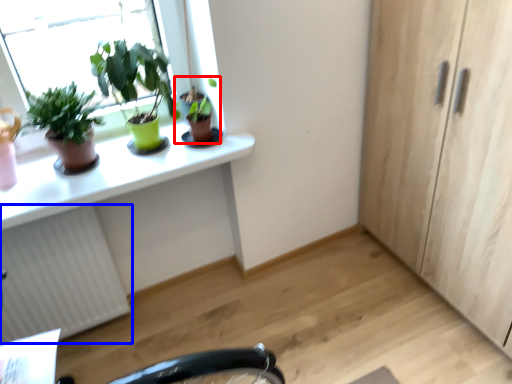
Question: Which object is further to the camera taking this photo, houseplant (highlighted by a red box) or radiator (highlighted by a blue box)?

Choices:
 (A) houseplant
 (B) radiator

Answer: (A)